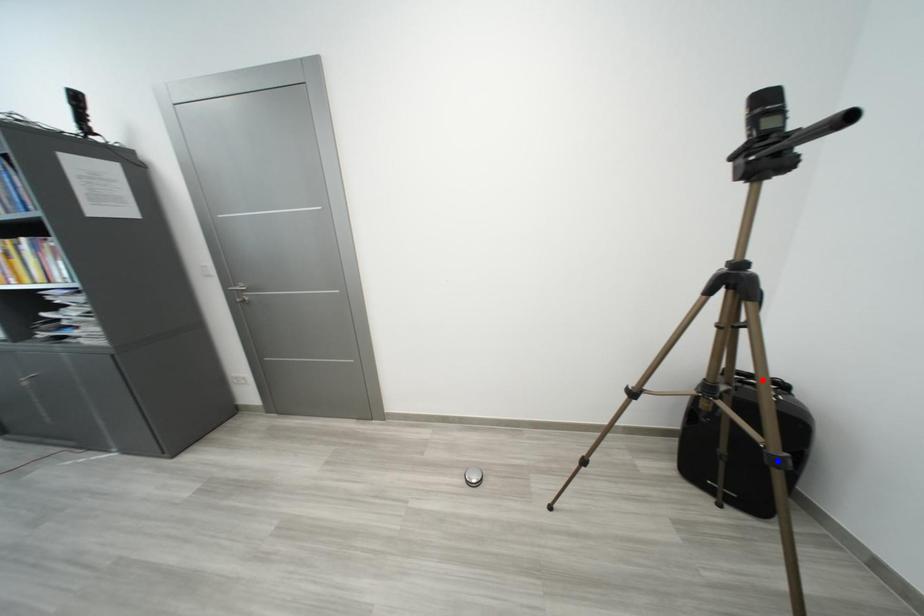
Question: Which of the two points in the image is closer to the camera?

Choices:
 (A) Blue point is closer.
 (B) Red point is closer.

Answer: (A)